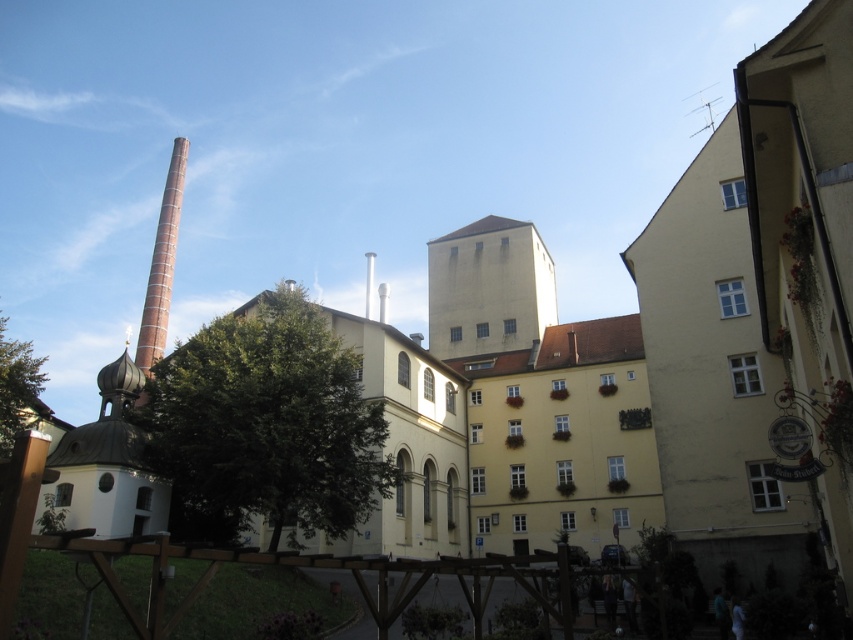
Who is higher up, beige concrete tower at center or green leafy tree at lower left?

beige concrete tower at center is higher up.

Between beige concrete tower at center and green leafy tree at lower left, which one has less height?

Standing shorter between the two is green leafy tree at lower left.

At what (x,y) coordinates should I click in order to perform the action: click on beige concrete tower at center. Please return your answer as a coordinate pair (x, y). The image size is (853, 640). Looking at the image, I should click on (488, 289).

Between point (170, 291) and point (22, 340), which one is positioned in front?

Point (170, 291) is more forward.

Is brick textured chimney at left to the right of green leafy tree at lower left from the viewer's perspective?

Yes, brick textured chimney at left is to the right of green leafy tree at lower left.

Does point (135, 353) come farther from viewer compared to point (10, 348)?

Yes, point (135, 353) is behind point (10, 348).

Locate an element on the screen. The width and height of the screenshot is (853, 640). brick textured chimney at left is located at coordinates (161, 262).

Does green leafy tree at center have a lesser height compared to green leafy tree at lower left?

No, green leafy tree at center is not shorter than green leafy tree at lower left.

Which is more to the left, green leafy tree at center or green leafy tree at lower left?

Positioned to the left is green leafy tree at lower left.

Locate an element on the screen. The height and width of the screenshot is (640, 853). green leafy tree at center is located at coordinates (265, 426).